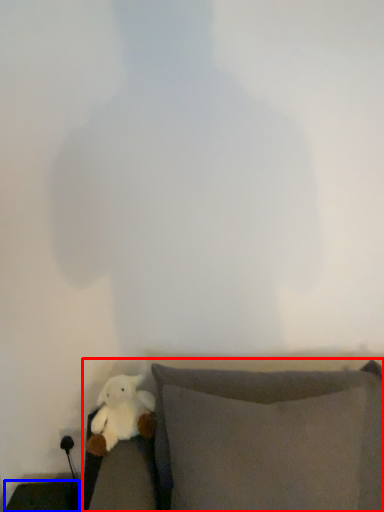
Question: Which point is closer to the camera, furniture (highlighted by a red box) or furniture (highlighted by a blue box)?

Choices:
 (A) furniture
 (B) furniture

Answer: (A)